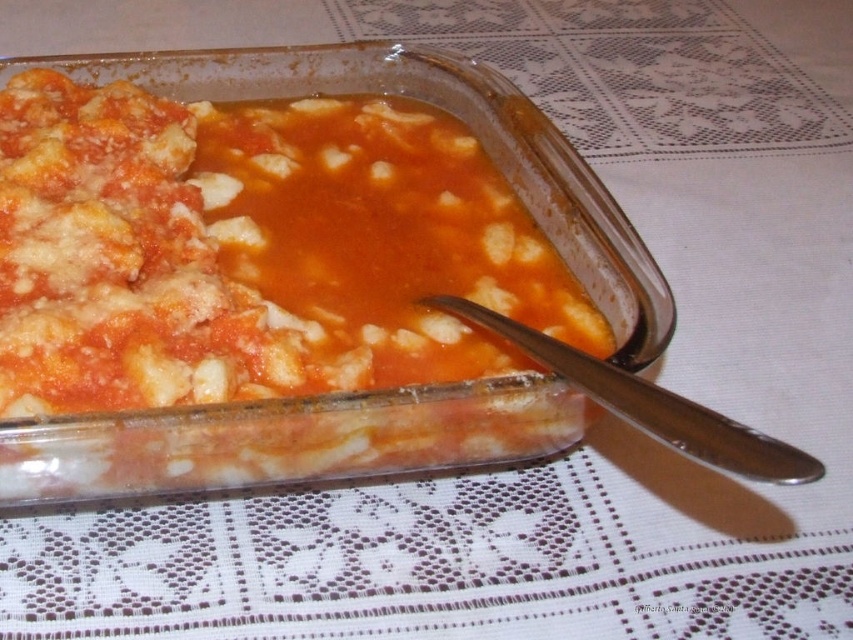
Does matte tomato sauce at center appear on the left side of silver metallic spoon at lower right?

Indeed, matte tomato sauce at center is positioned on the left side of silver metallic spoon at lower right.

Which is below, matte tomato sauce at center or silver metallic spoon at lower right?

silver metallic spoon at lower right is below.

Is point (438, 365) more distant than point (695, 413)?

Yes, point (438, 365) is behind point (695, 413).

This screenshot has width=853, height=640. Find the location of `matte tomato sauce at center`. matte tomato sauce at center is located at coordinates (252, 250).